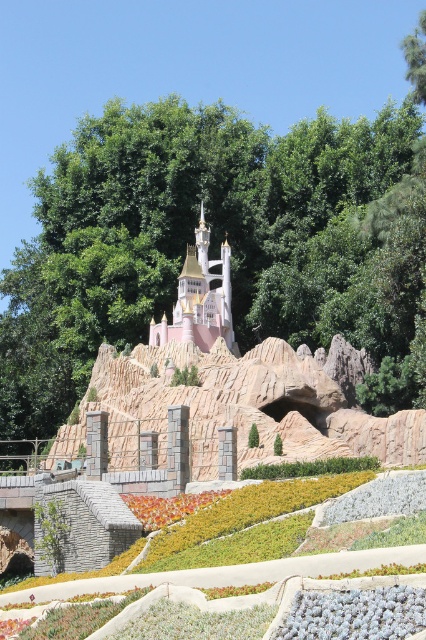
You are a miniature gardener working in the theme park. You need to place a new decorative statue that is 1.2 meters wide between the pastel pink stone castle at center and the vibrant orange petals at center. Can the statue fit between them based on their widths?

The pastel pink stone castle at center is wider than the vibrant orange petals at center. Since the statue is 1.2 meters wide, it depends on the combined width of both objects. However, the exact distance between them isn